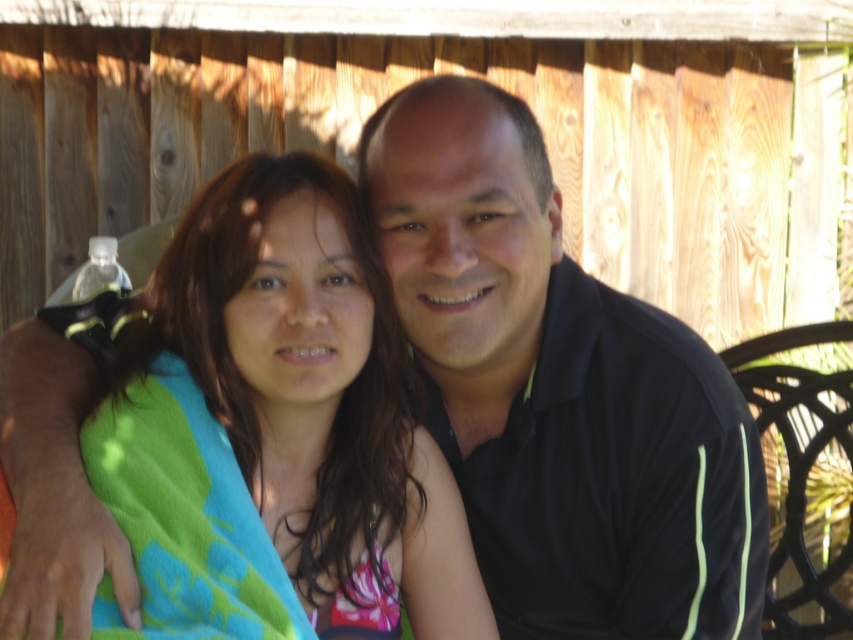
Who is lower down, black smooth shirt at center or green towel at center?

green towel at center

The width and height of the screenshot is (853, 640). What do you see at coordinates (560, 390) in the screenshot? I see `black smooth shirt at center` at bounding box center [560, 390].

Identify the location of black smooth shirt at center. This screenshot has width=853, height=640. (560, 390).

You are a GUI agent. You are given a task and a screenshot of the screen. Output one action in this format:
    pyautogui.click(x=<x>, y=<y>)
    Task: Click on the black smooth shirt at center
    This screenshot has height=640, width=853.
    Given the screenshot: What is the action you would take?
    pyautogui.click(x=560, y=390)